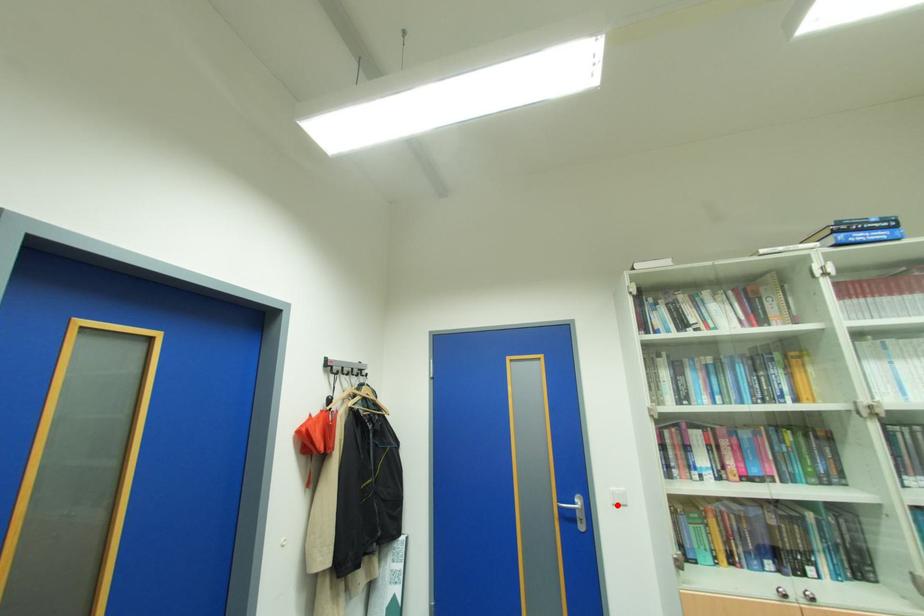
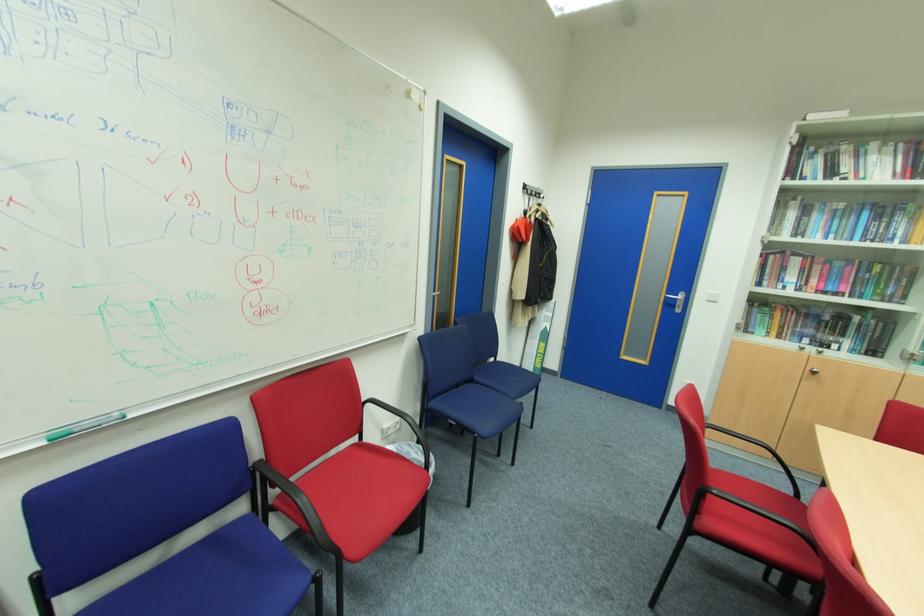
Question: I am providing you with two images of the same scene from different viewpoints. A red point is shown in image1. For the corresponding object point in image2, is it positioned nearer or farther from the camera?

Choices:
 (A) Nearer
 (B) Farther

Answer: (A)